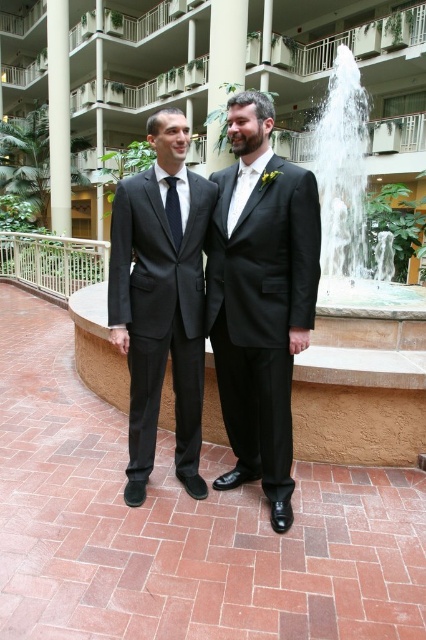
Which is below, matte black suit at center or black silk tie at center?

matte black suit at center is lower down.

Does matte black suit at center have a lesser width compared to black silk tie at center?

In fact, matte black suit at center might be wider than black silk tie at center.

Image resolution: width=426 pixels, height=640 pixels. Describe the element at coordinates (261, 312) in the screenshot. I see `matte black suit at center` at that location.

Where is `matte black suit at center`? This screenshot has width=426, height=640. matte black suit at center is located at coordinates coord(261,312).

Is point (54, 141) farther from camera compared to point (238, 193)?

Yes, it is behind point (238, 193).

Between point (51, 44) and point (244, 179), which one is positioned behind?

The point (51, 44) is behind.

This screenshot has width=426, height=640. What are the coordinates of `white glossy pillar at left` in the screenshot? It's located at (58, 115).

Does matte black suit at center appear on the right side of matte black bow tie at center?

Yes, matte black suit at center is to the right of matte black bow tie at center.

Who is more distant from viewer, (268,353) or (235,211)?

The point (235,211) is more distant.

Identify the location of matte black suit at center. This screenshot has height=640, width=426. (261, 312).